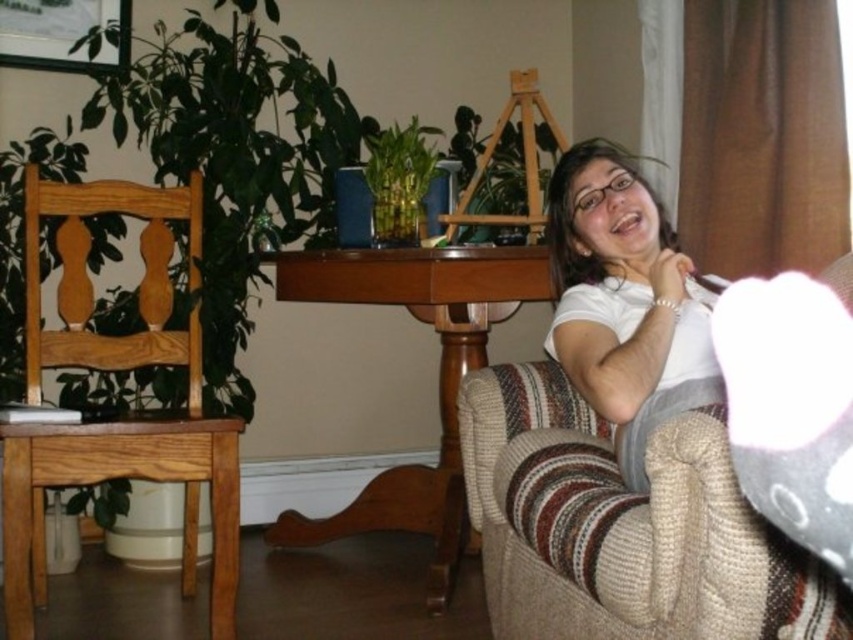
Does knitted beige couch at lower right appear on the right side of light brown wooden chair at left?

Correct, you'll find knitted beige couch at lower right to the right of light brown wooden chair at left.

Can you confirm if knitted beige couch at lower right is thinner than light brown wooden chair at left?

Correct, knitted beige couch at lower right's width is less than light brown wooden chair at left's.

Who is more forward, (743, 588) or (122, 474)?

Point (743, 588) is in front.

Find the location of a particular element. The image size is (853, 640). knitted beige couch at lower right is located at coordinates (622, 528).

Is light brown wooden chair at left further to the viewer compared to white matte shirt at center?

Yes, it is behind white matte shirt at center.

Does light brown wooden chair at left have a larger size compared to white matte shirt at center?

Indeed, light brown wooden chair at left has a larger size compared to white matte shirt at center.

Is point (218, 624) positioned after point (602, 337)?

Yes.

At what (x,y) coordinates should I click in order to perform the action: click on light brown wooden chair at left. Please return your answer as a coordinate pair (x, y). Looking at the image, I should click on pos(115,369).

Which is more to the left, knitted beige couch at lower right or white matte shirt at center?

knitted beige couch at lower right is more to the left.

Identify the location of knitted beige couch at lower right. (622, 528).